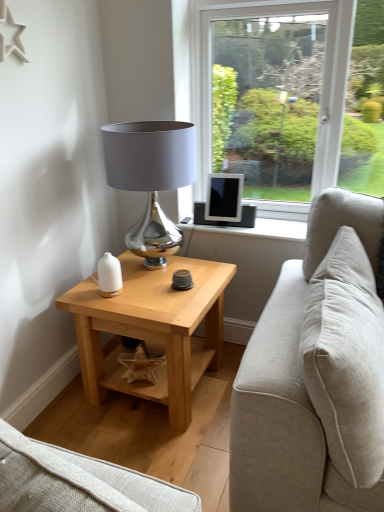
Question: From a real-world perspective, is light wood/texture side table at lower left physically above shiny metallic lampshade at center?

Choices:
 (A) yes
 (B) no

Answer: (B)

Question: From a real-world perspective, does light wood/texture side table at lower left sit lower than shiny metallic lampshade at center?

Choices:
 (A) no
 (B) yes

Answer: (B)

Question: Considering the relative positions of light wood/texture side table at lower left and shiny metallic lampshade at center in the image provided, is light wood/texture side table at lower left to the left of shiny metallic lampshade at center from the viewer's perspective?

Choices:
 (A) no
 (B) yes

Answer: (A)

Question: Is light wood/texture side table at lower left positioned in front of shiny metallic lampshade at center?

Choices:
 (A) no
 (B) yes

Answer: (B)

Question: Is light wood/texture side table at lower left bigger than shiny metallic lampshade at center?

Choices:
 (A) no
 (B) yes

Answer: (B)

Question: Is point (180, 147) positioned closer to the camera than point (337, 252)?

Choices:
 (A) farther
 (B) closer

Answer: (A)

Question: Considering their positions, is shiny metallic lampshade at center located in front of or behind beige fabric pillow at right?

Choices:
 (A) behind
 (B) front

Answer: (A)

Question: Considering the relative positions of shiny metallic lampshade at center and beige fabric pillow at right in the image provided, is shiny metallic lampshade at center to the left or to the right of beige fabric pillow at right?

Choices:
 (A) right
 (B) left

Answer: (B)

Question: From their relative heights in the image, would you say shiny metallic lampshade at center is taller or shorter than beige fabric pillow at right?

Choices:
 (A) tall
 (B) short

Answer: (B)

Question: From a real-world perspective, is shiny metallic lampshade at center positioned above or below light wood/texture side table at lower left?

Choices:
 (A) above
 (B) below

Answer: (A)

Question: Considering the positions of shiny metallic lampshade at center and light wood/texture side table at lower left in the image, is shiny metallic lampshade at center wider or thinner than light wood/texture side table at lower left?

Choices:
 (A) thin
 (B) wide

Answer: (A)

Question: In the image, is shiny metallic lampshade at center positioned in front of or behind light wood/texture side table at lower left?

Choices:
 (A) front
 (B) behind

Answer: (B)

Question: Is shiny metallic lampshade at center taller or shorter than light wood/texture side table at lower left?

Choices:
 (A) short
 (B) tall

Answer: (B)

Question: Is beige fabric pillow at right taller or shorter than light wood/texture side table at lower left?

Choices:
 (A) short
 (B) tall

Answer: (B)

Question: Considering the positions of point (327, 335) and point (102, 310), is point (327, 335) closer or farther from the camera than point (102, 310)?

Choices:
 (A) closer
 (B) farther

Answer: (A)